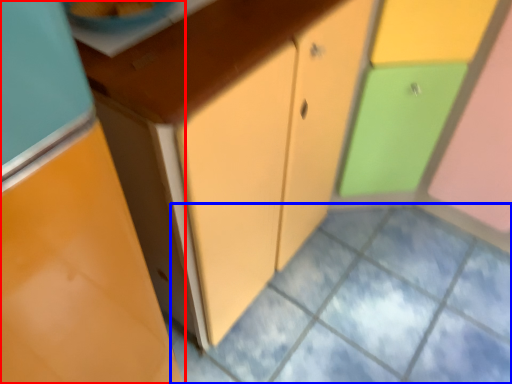
Question: Which object is further to the camera taking this photo, cabinetry (highlighted by a red box) or square (highlighted by a blue box)?

Choices:
 (A) cabinetry
 (B) square

Answer: (B)